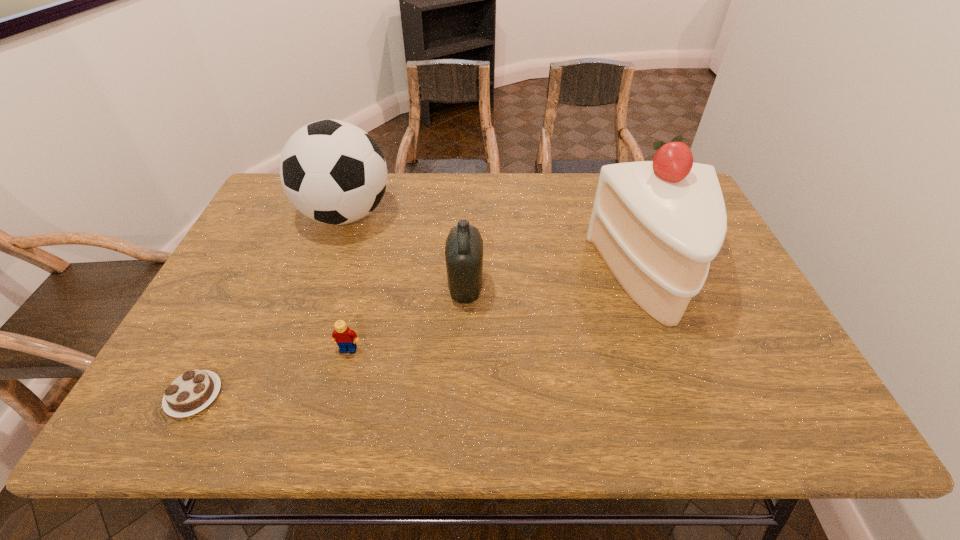
At what (x,y) coordinates should I click in order to perform the action: click on cake. Please return your answer as a coordinate pair (x, y). Looking at the image, I should click on (657, 224).

You are a GUI agent. You are given a task and a screenshot of the screen. Output one action in this format:
    pyautogui.click(x=<x>, y=<y>)
    Task: Click on the fourth shortest object
    This screenshot has width=960, height=540.
    Given the screenshot: What is the action you would take?
    pyautogui.click(x=332, y=171)

Locate an element on the screen. the third tallest object is located at coordinates (464, 246).

I want to click on the fourth object from left to right, so click(464, 246).

Identify the location of the second shortest object. (345, 338).

Image resolution: width=960 pixels, height=540 pixels. I want to click on Lego, so pos(345,338).

Locate an element on the screen. The image size is (960, 540). the shortest object is located at coordinates (191, 392).

The height and width of the screenshot is (540, 960). What are the coordinates of `chocolate cake` in the screenshot? It's located at (191, 392).

Locate an element on the screen. Image resolution: width=960 pixels, height=540 pixels. vacant space located 0.170m on the back of the cake is located at coordinates (622, 202).

Locate an element on the screen. The height and width of the screenshot is (540, 960). vacant space located 0.130m on the right of the second tallest object is located at coordinates (436, 214).